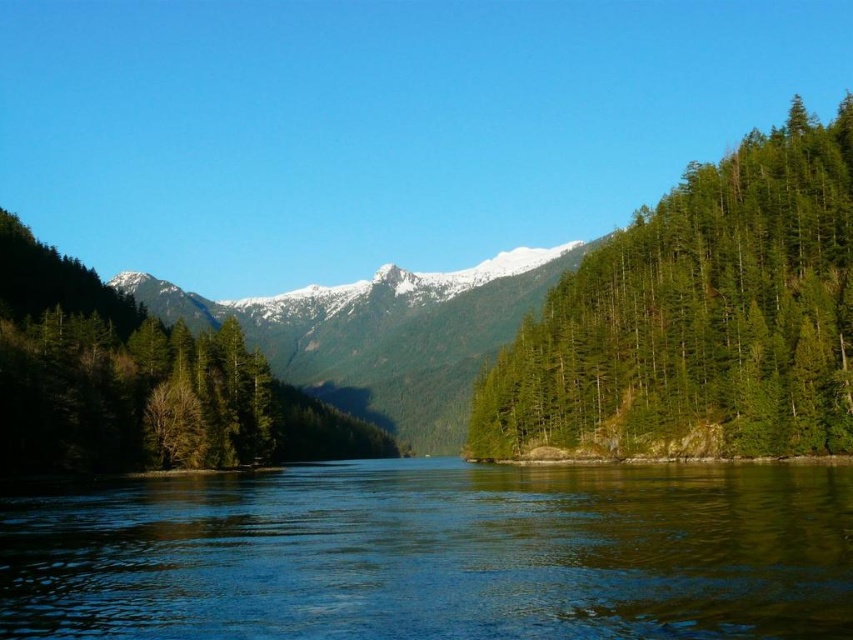
Who is lower down, green reflective water at center or green textured forest at right?

green reflective water at center

Is point (370, 524) more distant than point (705, 426)?

No, (370, 524) is in front of (705, 426).

Between point (798, 470) and point (759, 444), which one is positioned in front?

Point (798, 470) is in front.

Locate an element on the screen. The image size is (853, 640). green reflective water at center is located at coordinates (436, 554).

How distant is green reflective water at center from green matte tree at center?

72.92 meters

Locate an element on the screen. The image size is (853, 640). green reflective water at center is located at coordinates (436, 554).

The height and width of the screenshot is (640, 853). In order to click on green reflective water at center in this screenshot , I will do `click(436, 554)`.

Can you confirm if green textured forest at right is positioned to the left of snowy rocky mountain at center?

In fact, green textured forest at right is to the right of snowy rocky mountain at center.

Is point (799, 234) farther from viewer compared to point (345, 323)?

That is False.

Find the location of `green textured forest at right`. green textured forest at right is located at coordinates (695, 320).